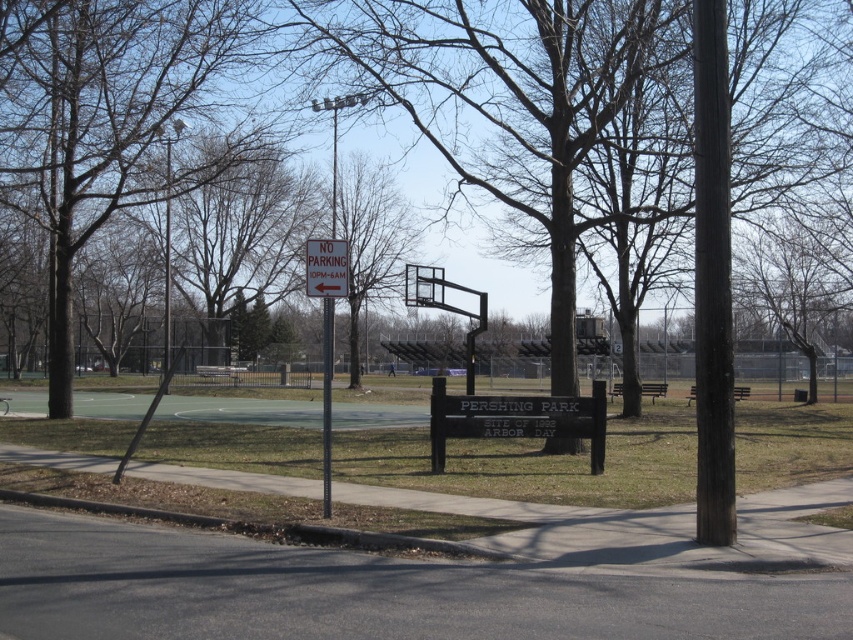
Question: Does brown wood tree at center lie in front of black metal basketball hoop at center?

Choices:
 (A) yes
 (B) no

Answer: (A)

Question: Does brown wood tree at center have a larger size compared to white paper sign at center?

Choices:
 (A) no
 (B) yes

Answer: (B)

Question: Which of the following is the farthest from the observer?

Choices:
 (A) brown wood tree at center
 (B) black metal basketball hoop at center

Answer: (B)

Question: Among these objects, which one is nearest to the camera?

Choices:
 (A) brown bark tree at center
 (B) brown wood tree at center
 (C) black metal basketball hoop at center
 (D) white paper sign at center

Answer: (B)

Question: Can you confirm if brown wood tree at center is positioned above black metal basketball hoop at center?

Choices:
 (A) yes
 (B) no

Answer: (A)

Question: Based on their relative distances, which object is nearer to the brown wood tree at center?

Choices:
 (A) brown bark tree at center
 (B) black metal basketball hoop at center

Answer: (A)